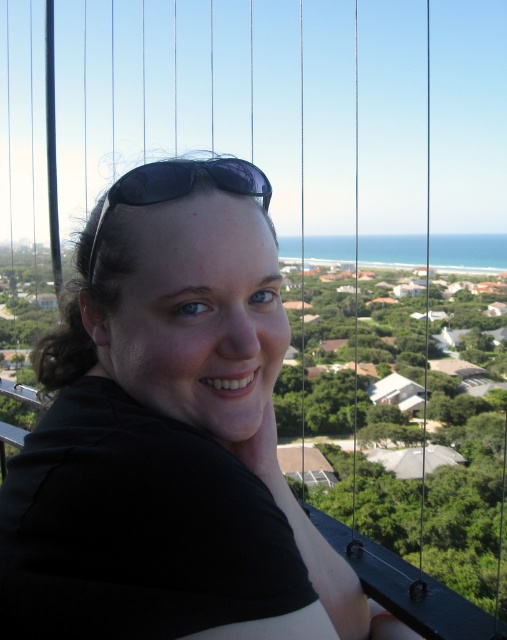
Who is more distant from viewer, (26, 576) or (183, 163)?

Positioned behind is point (183, 163).

Between point (134, 432) and point (220, 177), which one is positioned in front?

Point (134, 432)

Who is more distant from viewer, (x=188, y=509) or (x=140, y=180)?

The point (x=140, y=180) is behind.

Find the location of `black matte shirt at center`. black matte shirt at center is located at coordinates (169, 435).